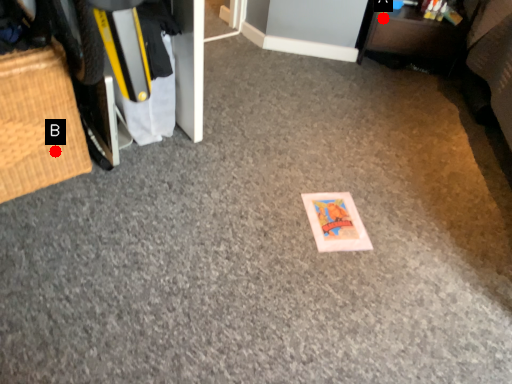
Question: Two points are circled on the image, labeled by A and B beside each circle. Which point is farther from the camera taking this photo?

Choices:
 (A) A is further
 (B) B is further

Answer: (A)